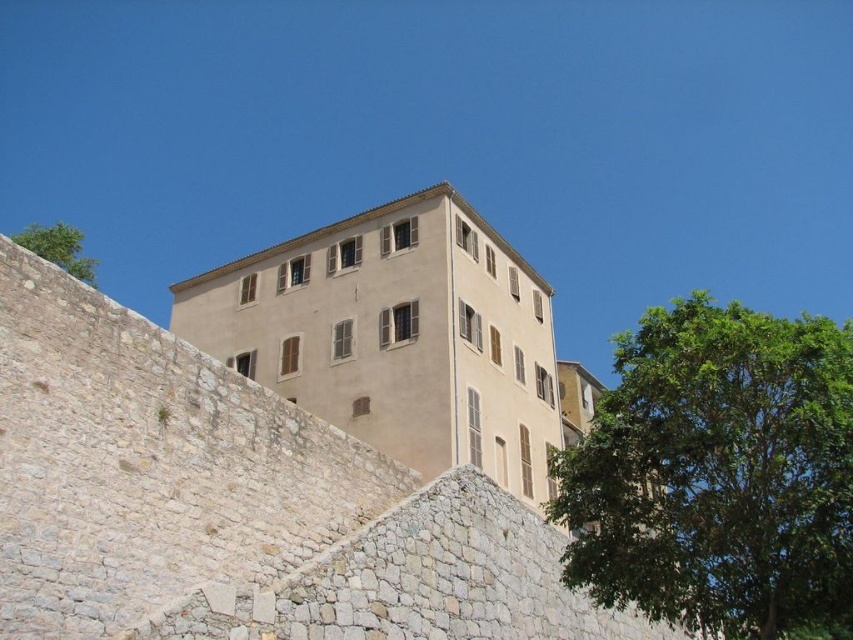
Can you confirm if beige stone wall at center is positioned above green leafy tree at upper left?

Actually, beige stone wall at center is below green leafy tree at upper left.

Is beige stone wall at center further to camera compared to green leafy tree at upper left?

No, it is in front of green leafy tree at upper left.

Between point (210, 394) and point (21, 230), which one is positioned in front?

Point (210, 394) is in front.

Find the location of a particular element. The height and width of the screenshot is (640, 853). beige stone wall at center is located at coordinates (234, 502).

Does beige stone wall at center appear on the right side of green leafy tree at right?

No, beige stone wall at center is not to the right of green leafy tree at right.

The image size is (853, 640). What do you see at coordinates (234, 502) in the screenshot?
I see `beige stone wall at center` at bounding box center [234, 502].

At what (x,y) coordinates should I click in order to perform the action: click on beige stone wall at center. Please return your answer as a coordinate pair (x, y). Looking at the image, I should click on 234,502.

Does green leafy tree at right have a smaller size compared to beige matte building at center?

Incorrect, green leafy tree at right is not smaller in size than beige matte building at center.

In the scene shown: Does green leafy tree at right have a lesser width compared to beige matte building at center?

Incorrect, green leafy tree at right's width is not less than beige matte building at center's.

Does point (749, 616) come farther from viewer compared to point (526, 355)?

No.

Locate an element on the screen. The image size is (853, 640). green leafy tree at right is located at coordinates [x=718, y=474].